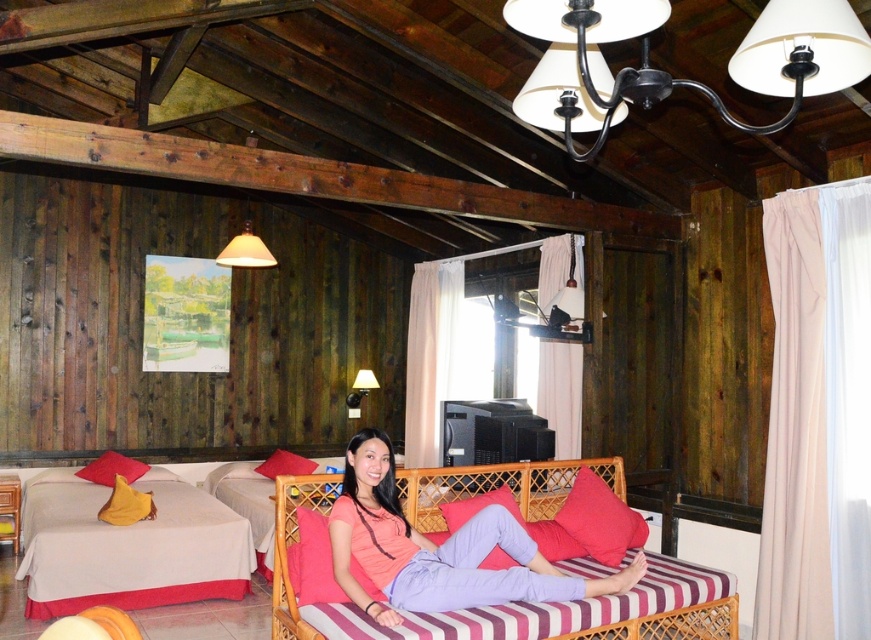
Question: Among these points, which one is nearest to the camera?

Choices:
 (A) (295, 452)
 (B) (579, 547)

Answer: (B)

Question: Which object is closer to the camera taking this photo?

Choices:
 (A) matte black wall lamp at upper center
 (B) matte red cushion at center

Answer: (B)

Question: Is white woven couch at lower left behind pink fabric couch at center?

Choices:
 (A) no
 (B) yes

Answer: (B)

Question: Is white woven couch at lower left below black metal chandelier at upper center?

Choices:
 (A) no
 (B) yes

Answer: (B)

Question: Is the position of matte red pillow at lower left less distant than that of matte black wall lamp at upper center?

Choices:
 (A) no
 (B) yes

Answer: (B)

Question: Which of these objects is positioned farthest from the matte black wall lamp at upper center?

Choices:
 (A) matte red cushion at center
 (B) red cotton pillow at center
 (C) pink fabric couch at center
 (D) white woven couch at lower left

Answer: (C)